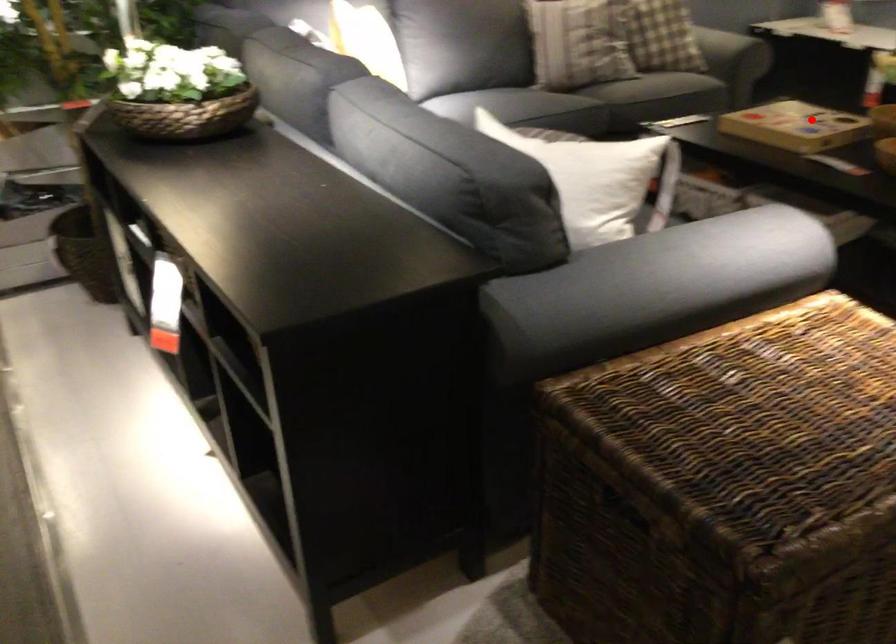
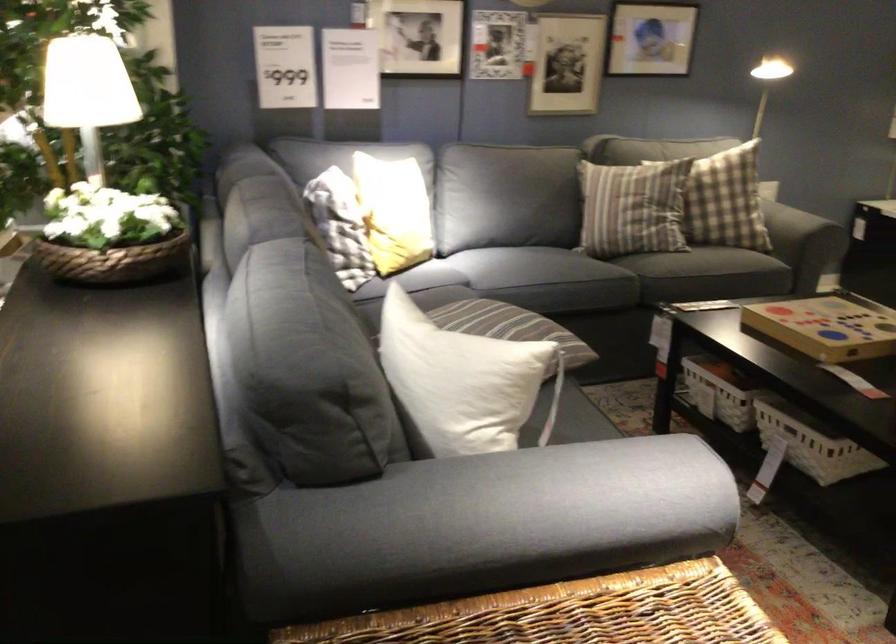
Locate, in the second image, the point that corresponds to the highlighted location in the first image.

(828, 326)